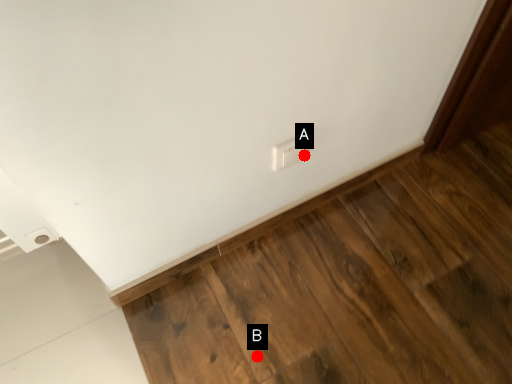
Question: Two points are circled on the image, labeled by A and B beside each circle. Which of the following is the farthest from the observer?

Choices:
 (A) A is further
 (B) B is further

Answer: (B)